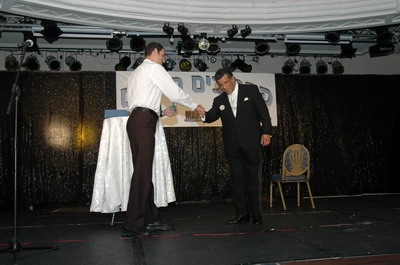
This screenshot has width=400, height=265. Identify the location of chair. (291, 170).